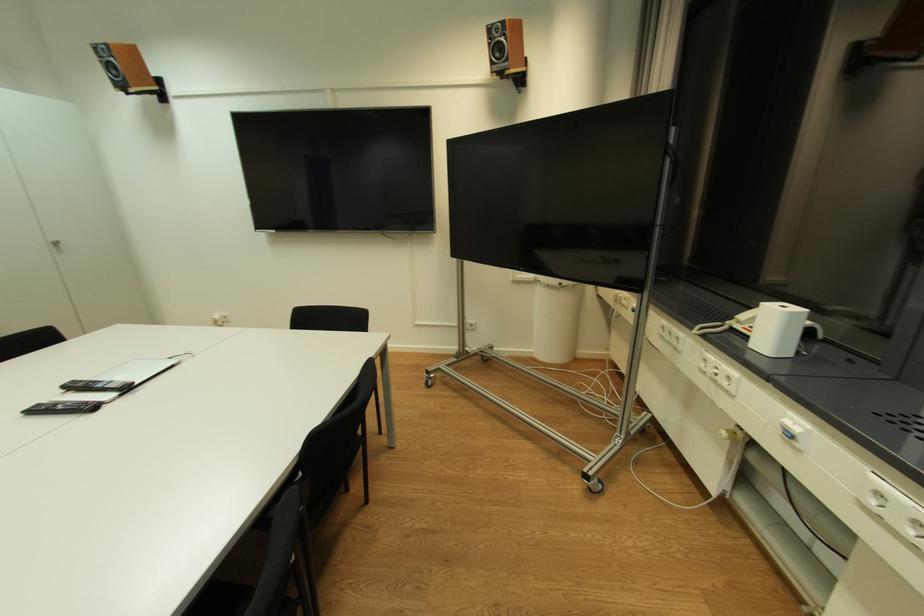
What do you see at coordinates (555, 318) in the screenshot? I see `the white trash can` at bounding box center [555, 318].